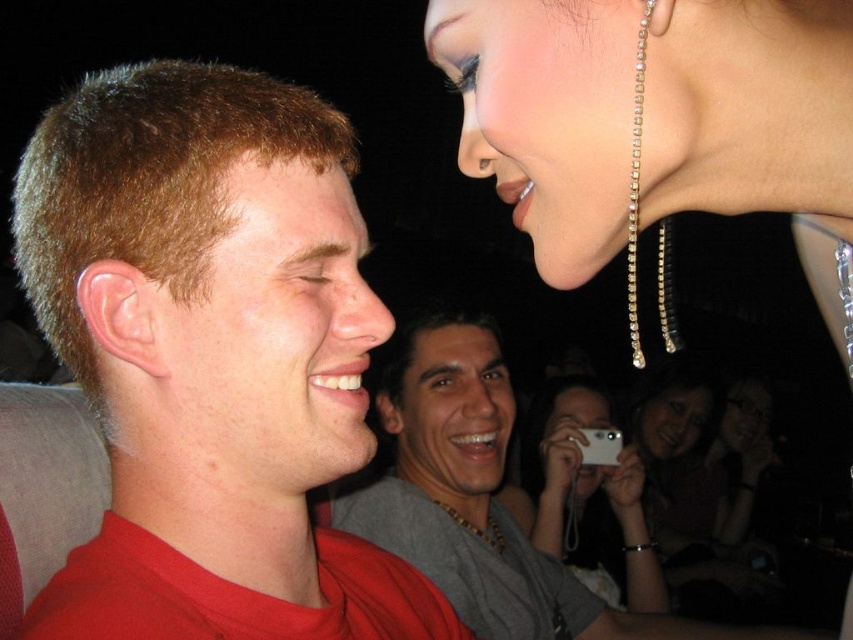
Which of these two, matte red shirt at left or matte black camera at center, stands taller?

Standing taller between the two is matte black camera at center.

At what (x,y) coordinates should I click in order to perform the action: click on matte red shirt at left. Please return your answer as a coordinate pair (x, y). The width and height of the screenshot is (853, 640). Looking at the image, I should click on (212, 356).

You are a GUI agent. You are given a task and a screenshot of the screen. Output one action in this format:
    pyautogui.click(x=<x>, y=<y>)
    Task: Click on the matte red shirt at left
    The width and height of the screenshot is (853, 640).
    Given the screenshot: What is the action you would take?
    pyautogui.click(x=212, y=356)

I want to click on gray necklace at center, so click(459, 483).

Image resolution: width=853 pixels, height=640 pixels. What do you see at coordinates (459, 483) in the screenshot?
I see `gray necklace at center` at bounding box center [459, 483].

Identify the location of gray necklace at center. This screenshot has width=853, height=640. (459, 483).

In the scene shown: Is matte red shirt at left thinner than white plastic phone at center?

Incorrect, matte red shirt at left's width is not less than white plastic phone at center's.

From the picture: Can you confirm if matte red shirt at left is positioned to the right of white plastic phone at center?

In fact, matte red shirt at left is to the left of white plastic phone at center.

Is point (198, 456) in front of point (602, 465)?

That is True.

What are the coordinates of `matte red shirt at left` in the screenshot? It's located at (212, 356).